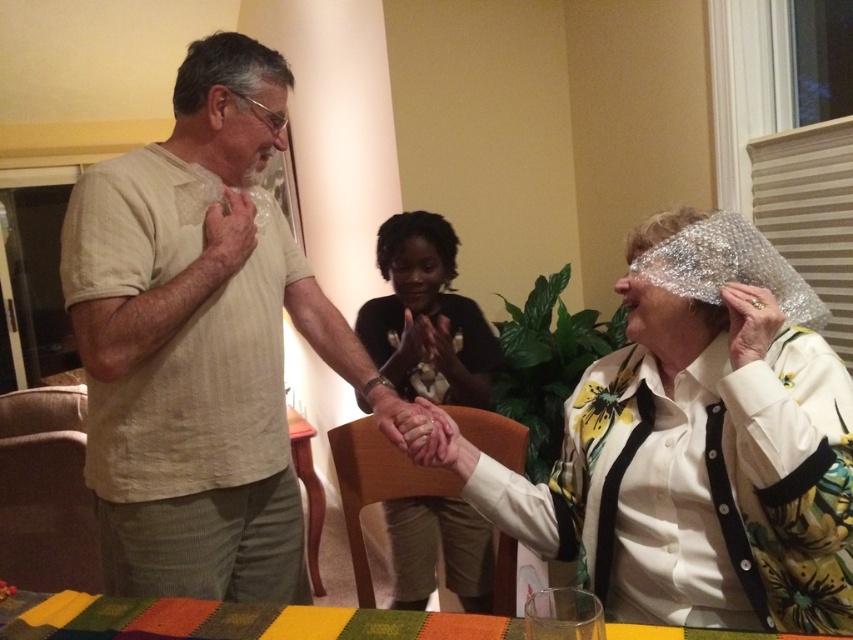
Who is shorter, shiny metallic foil at center or matte black shirt at center?

matte black shirt at center is shorter.

Who is positioned more to the left, shiny metallic foil at center or matte black shirt at center?

From the viewer's perspective, matte black shirt at center appears more on the left side.

Is point (527, 518) closer to viewer compared to point (428, 236)?

Yes.

Where is `shiny metallic foil at center`? shiny metallic foil at center is located at coordinates (695, 470).

Who is higher up, beige textured shirt at center or matte black shirt at center?

matte black shirt at center is above.

Between beige textured shirt at center and matte black shirt at center, which one appears on the right side from the viewer's perspective?

matte black shirt at center

Who is more distant from viewer, (x=71, y=266) or (x=454, y=308)?

Point (x=454, y=308)

Identify the location of beige textured shirt at center. The image size is (853, 640). (200, 342).

Does beige textured shirt at center appear on the right side of shiny metallic foil at center?

In fact, beige textured shirt at center is to the left of shiny metallic foil at center.

Between beige textured shirt at center and shiny metallic foil at center, which one is positioned lower?

shiny metallic foil at center is lower down.

Describe the element at coordinates (200, 342) in the screenshot. This screenshot has width=853, height=640. I see `beige textured shirt at center` at that location.

Find the location of `beige textured shirt at center`. beige textured shirt at center is located at coordinates (200, 342).